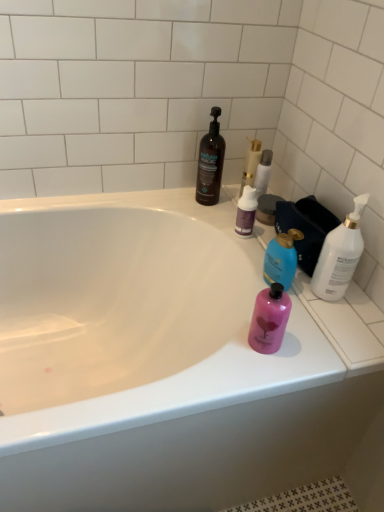
The image size is (384, 512). What are the coordinates of `free location to the right of blue glossy bottle at upper right, the fourth bottle positioned from the left` in the screenshot? It's located at (335, 305).